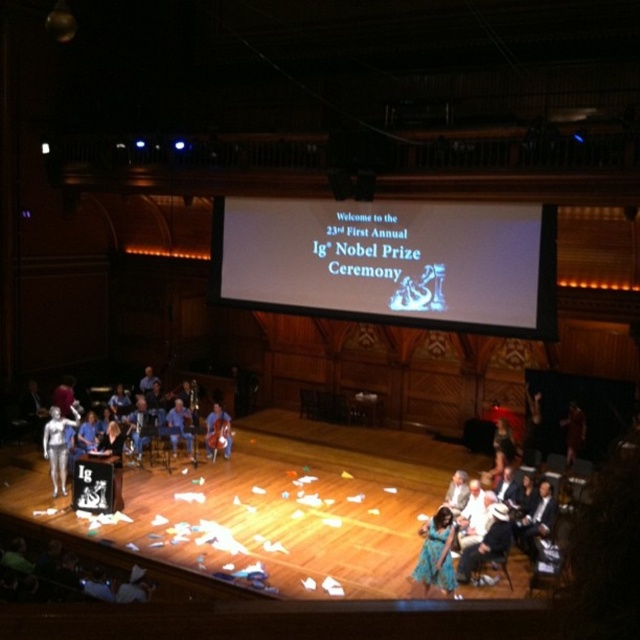
Question: Can you confirm if silver metallic figure at left is positioned above blue satin dress at center?

Choices:
 (A) no
 (B) yes

Answer: (B)

Question: Which point is closer to the camera?

Choices:
 (A) white paper at center
 (B) light brown leather jacket at center
 (C) blue satin dress at center
 (D) blue fabric chair at center

Answer: (C)

Question: Does white paper at center have a lesser width compared to light brown leather jacket at center?

Choices:
 (A) yes
 (B) no

Answer: (A)

Question: Which point is farther from the camera taking this photo?

Choices:
 (A) (499, 422)
 (B) (52, 412)
 (C) (52, 465)
 (D) (544, 278)

Answer: (A)

Question: Which point is farther to the camera?

Choices:
 (A) blue satin dress at center
 (B) silver metallic figure at left
 (C) blue fabric cello at center
 (D) matte silver person at center

Answer: (C)

Question: Can you confirm if silver metallic statue at center is bigger than blue fabric chair at center?

Choices:
 (A) no
 (B) yes

Answer: (A)